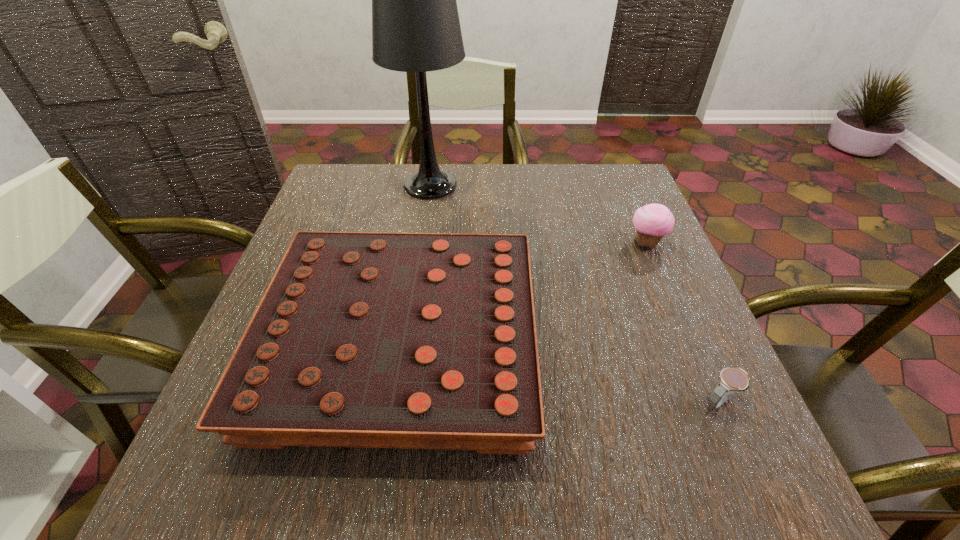
You are a GUI agent. You are given a task and a screenshot of the screen. Output one action in this format:
    pyautogui.click(x=<x>, y=<y>)
    Task: Click on the object located in the near edge section of the desktop
    The height and width of the screenshot is (540, 960).
    Given the screenshot: What is the action you would take?
    pyautogui.click(x=362, y=339)

Where is `object that is at the left edge`? The height and width of the screenshot is (540, 960). object that is at the left edge is located at coordinates (362, 339).

This screenshot has height=540, width=960. What are the coordinates of `cupcake present at the right edge` in the screenshot? It's located at (653, 221).

The width and height of the screenshot is (960, 540). Find the location of `watch situated at the right edge`. watch situated at the right edge is located at coordinates (731, 379).

At what (x,y) coordinates should I click in order to perform the action: click on object positioned at the near left corner. Please return your answer as a coordinate pair (x, y). This screenshot has height=540, width=960. Looking at the image, I should click on (362, 339).

In the image, there is a desktop. At what (x,y) coordinates should I click in order to perform the action: click on vacant space at the far edge. Please return your answer as a coordinate pair (x, y). The height and width of the screenshot is (540, 960). Looking at the image, I should click on (540, 171).

Find the location of a particular element. The height and width of the screenshot is (540, 960). vacant space at the near edge of the desktop is located at coordinates (651, 494).

Image resolution: width=960 pixels, height=540 pixels. In order to click on vacant space at the right edge of the desktop in this screenshot , I will do point(681,429).

Identify the location of vacant area at the far left corner. (330, 188).

In the image, there is a desktop. At what (x,y) coordinates should I click in order to perform the action: click on free space at the far right corner. Please return your answer as a coordinate pair (x, y). The width and height of the screenshot is (960, 540). Looking at the image, I should click on (610, 167).